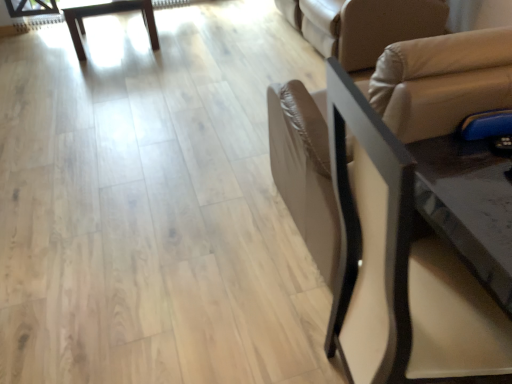
Locate an element on the screen. This screenshot has height=384, width=512. free space in front of wooden table at upper left is located at coordinates (100, 76).